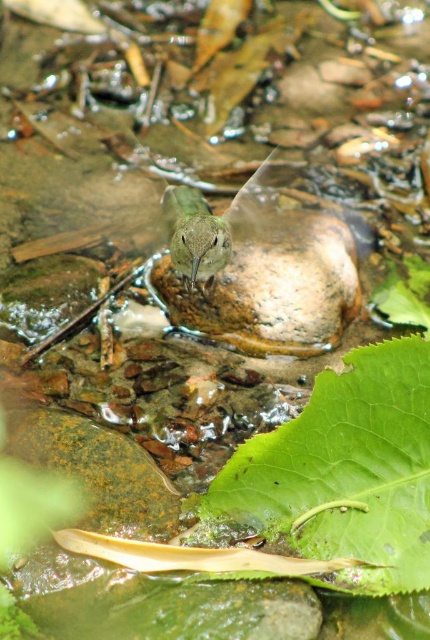
You are a photographer aiming to capture the green matte bird at center and the green matte leaf at lower center in a single shot. Based on their sizes, which object would appear larger in the photo?

The green matte bird at center would appear larger in the photo because it is bigger than the green matte leaf at lower center.

You are a photographer trying to capture the green matte bird at center and the green matte leaf at lower center in the same frame. Based on their positions, which object is closer to the camera?

The green matte leaf at lower center is below the green matte bird at center, so the bird is closer to the camera than the leaf.

You are an ornithologist observing the green matte bird at center and the green matte leaf at lower center in the stream area. Which object has a greater width?

The green matte leaf at lower center has a greater width than the green matte bird at center, as stated in the description.